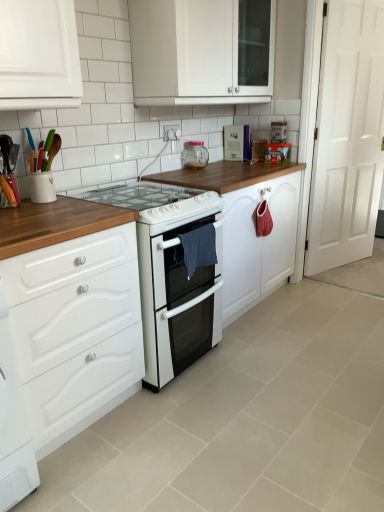
Question: In which direction should I rotate to look at metallic silver book at upper center, which appears as the 1th appliance when viewed from the back?

Choices:
 (A) left
 (B) right

Answer: (B)

Question: Is white wooden door at right completely or partially outside of metallic silver book at upper center, marked as the 1th appliance in a right-to-left arrangement?

Choices:
 (A) no
 (B) yes

Answer: (B)

Question: Considering the relative sizes of white wooden door at right and metallic silver book at upper center, marked as the 1th appliance in a right-to-left arrangement, in the image provided, is white wooden door at right smaller than metallic silver book at upper center, marked as the 1th appliance in a right-to-left arrangement,?

Choices:
 (A) no
 (B) yes

Answer: (A)

Question: Is white wooden door at right closer to the viewer compared to metallic silver book at upper center, the first appliance when ordered from top to bottom?

Choices:
 (A) yes
 (B) no

Answer: (A)

Question: Does white wooden door at right appear on the right side of metallic silver book at upper center, which appears as the 1th appliance when viewed from the back?

Choices:
 (A) yes
 (B) no

Answer: (A)

Question: Does white wooden door at right touch metallic silver book at upper center, the first appliance when ordered from top to bottom?

Choices:
 (A) yes
 (B) no

Answer: (B)

Question: Is white wooden door at right aimed at metallic silver book at upper center, marked as the 1th appliance in a right-to-left arrangement?

Choices:
 (A) no
 (B) yes

Answer: (A)

Question: From a real-world perspective, is white glossy gas stove at center on top of white glossy cabinet at lower left, the 2th cabinetry from the top?

Choices:
 (A) yes
 (B) no

Answer: (A)

Question: From the image's perspective, is white glossy gas stove at center over white glossy cabinet at lower left, the 2th cabinetry from the top?

Choices:
 (A) no
 (B) yes

Answer: (B)

Question: Can you confirm if white glossy gas stove at center is shorter than white glossy cabinet at lower left, the first cabinetry when ordered from bottom to top?

Choices:
 (A) no
 (B) yes

Answer: (A)

Question: Can you see white glossy gas stove at center touching white glossy cabinet at lower left, the first cabinetry when ordered from bottom to top?

Choices:
 (A) yes
 (B) no

Answer: (B)

Question: Does white glossy gas stove at center appear on the left side of white glossy cabinet at lower left, the first cabinetry when ordered from bottom to top?

Choices:
 (A) no
 (B) yes

Answer: (B)

Question: Considering the relative positions of white glossy gas stove at center and white glossy cabinet at lower left, the first cabinetry when ordered from bottom to top, in the image provided, is white glossy gas stove at center behind white glossy cabinet at lower left, the first cabinetry when ordered from bottom to top,?

Choices:
 (A) no
 (B) yes

Answer: (B)

Question: Is white glossy gas stove at center oriented towards white glossy cabinet at upper center, which is the 1th cabinetry in top-to-bottom order?

Choices:
 (A) yes
 (B) no

Answer: (B)